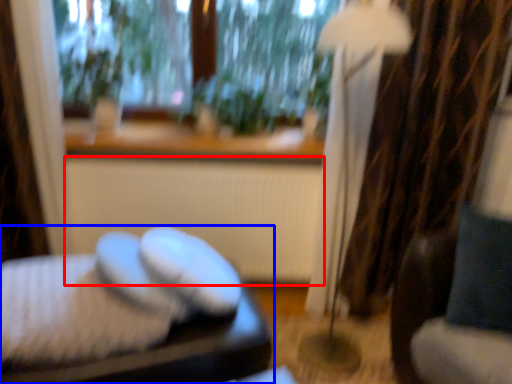
Question: Among these objects, which one is nearest to the camera, radiator (highlighted by a red box) or furniture (highlighted by a blue box)?

Choices:
 (A) radiator
 (B) furniture

Answer: (B)